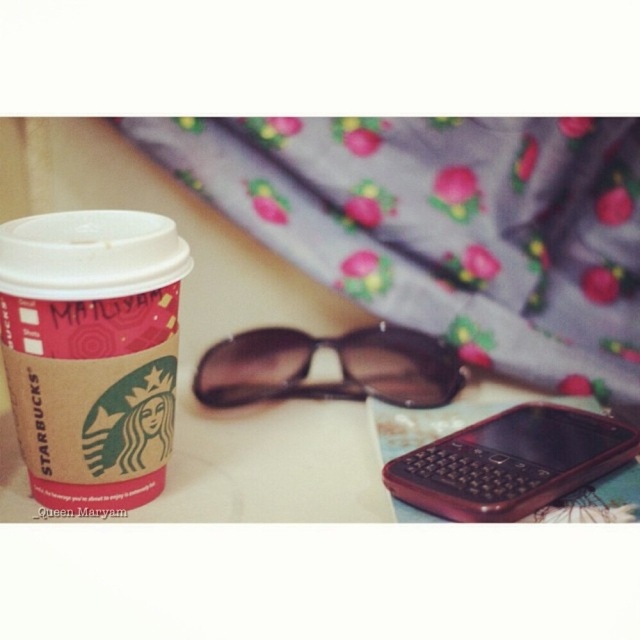
Question: Which object appears closest to the camera in this image?

Choices:
 (A) brown kraft paper cup at left
 (B) rubberized red phone at lower right

Answer: (A)

Question: Can you confirm if rubberized red phone at lower right is thinner than brown matte sunglasses at center?

Choices:
 (A) no
 (B) yes

Answer: (B)

Question: Can you confirm if rubberized red phone at lower right is positioned to the left of brown matte sunglasses at center?

Choices:
 (A) yes
 (B) no

Answer: (B)

Question: Based on their relative distances, which object is nearer to the brown matte sunglasses at center?

Choices:
 (A) rubberized red phone at lower right
 (B) brown kraft paper cup at left

Answer: (A)

Question: Is brown kraft paper cup at left thinner than brown matte sunglasses at center?

Choices:
 (A) no
 (B) yes

Answer: (B)

Question: Based on their relative distances, which object is farther from the brown matte sunglasses at center?

Choices:
 (A) brown kraft paper cup at left
 (B) rubberized red phone at lower right

Answer: (A)